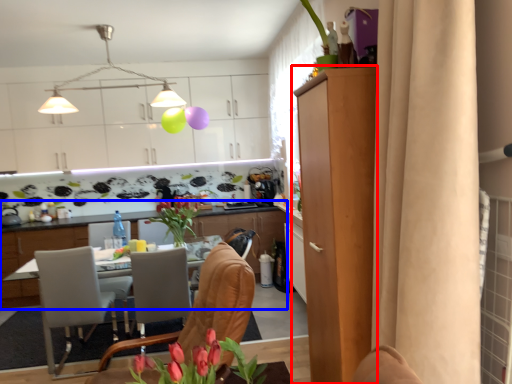
Question: Which object is closer to the camera taking this photo, cabinetry (highlighted by a red box) or cabinetry (highlighted by a blue box)?

Choices:
 (A) cabinetry
 (B) cabinetry

Answer: (A)